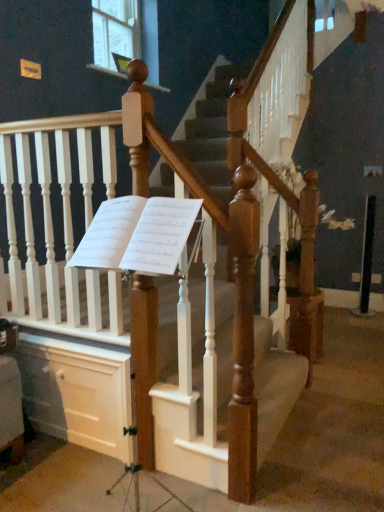
Question: From the image's perspective, is white paper sheet music at center below wooden staircase at center?

Choices:
 (A) yes
 (B) no

Answer: (B)

Question: Is white paper sheet music at center next to wooden staircase at center and touching it?

Choices:
 (A) yes
 (B) no

Answer: (B)

Question: Can you confirm if white paper sheet music at center is wider than wooden staircase at center?

Choices:
 (A) yes
 (B) no

Answer: (B)

Question: Is white paper sheet music at center positioned with its back to wooden staircase at center?

Choices:
 (A) no
 (B) yes

Answer: (A)

Question: Can you confirm if white paper sheet music at center is positioned to the right of wooden staircase at center?

Choices:
 (A) yes
 (B) no

Answer: (B)

Question: Is point (139, 34) closer or farther from the camera than point (51, 367)?

Choices:
 (A) closer
 (B) farther

Answer: (B)

Question: In terms of size, does clear glass window at upper center appear bigger or smaller than white painted wood drawer at lower left?

Choices:
 (A) small
 (B) big

Answer: (A)

Question: Is clear glass window at upper center inside or outside of white painted wood drawer at lower left?

Choices:
 (A) outside
 (B) inside

Answer: (A)

Question: From a real-world perspective, relative to white painted wood drawer at lower left, is clear glass window at upper center vertically above or below?

Choices:
 (A) below
 (B) above

Answer: (B)

Question: Considering their positions, is white paper sheet music at center located in front of or behind white painted wood drawer at lower left?

Choices:
 (A) behind
 (B) front

Answer: (B)

Question: Visually, is white paper sheet music at center positioned to the left or to the right of white painted wood drawer at lower left?

Choices:
 (A) right
 (B) left

Answer: (A)

Question: Is white paper sheet music at center wider or thinner than white painted wood drawer at lower left?

Choices:
 (A) wide
 (B) thin

Answer: (A)

Question: From a real-world perspective, relative to white painted wood drawer at lower left, is white paper sheet music at center vertically above or below?

Choices:
 (A) below
 (B) above

Answer: (B)

Question: Is point (145, 56) positioned closer to the camera than point (36, 423)?

Choices:
 (A) farther
 (B) closer

Answer: (A)

Question: From their relative heights in the image, would you say clear glass window at upper center is taller or shorter than wooden staircase at center?

Choices:
 (A) tall
 (B) short

Answer: (A)